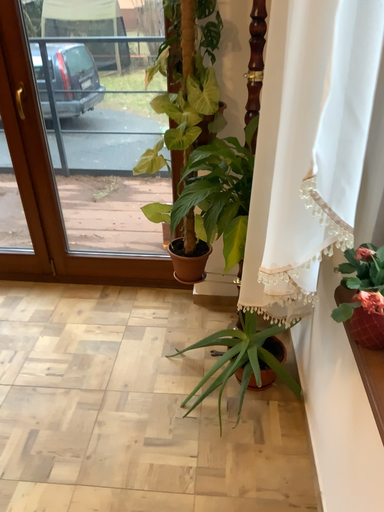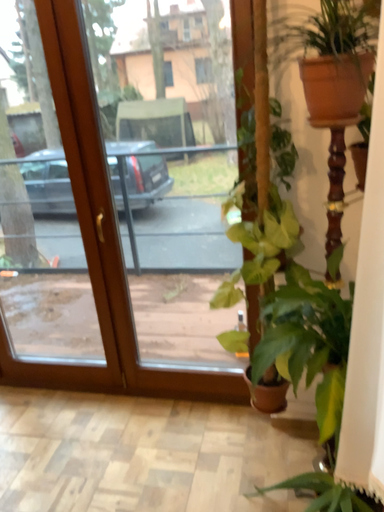
Question: Which way did the camera rotate in the video?

Choices:
 (A) rotated right
 (B) rotated left

Answer: (B)